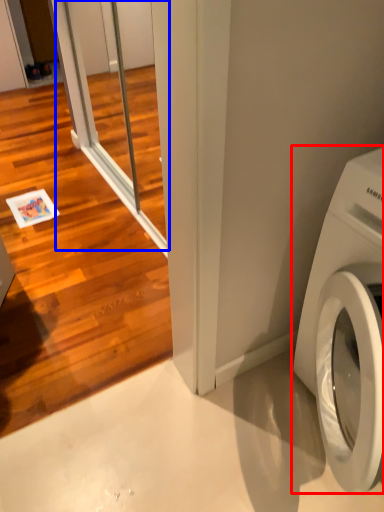
Question: Which point is further to the camera, washing machine (highlighted by a red box) or screen door (highlighted by a blue box)?

Choices:
 (A) washing machine
 (B) screen door

Answer: (B)